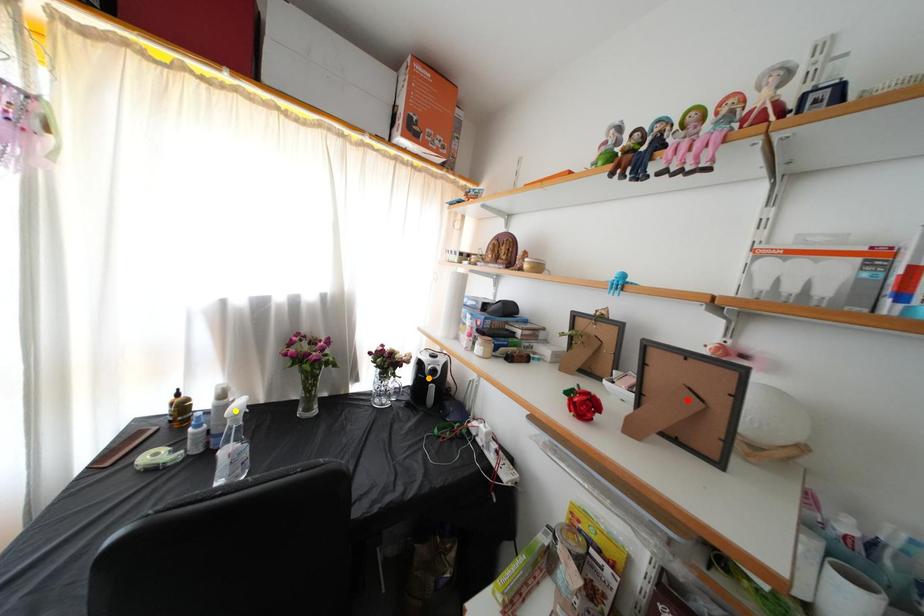
Order these from farthest to nearest:
- orange point
- yellow point
- red point

orange point < yellow point < red point